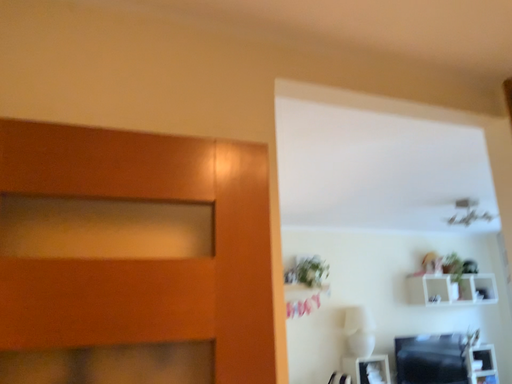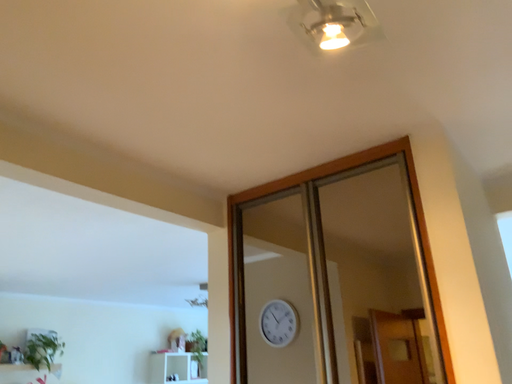
Question: Which way did the camera rotate in the video?

Choices:
 (A) rotated downward
 (B) rotated upward

Answer: (B)